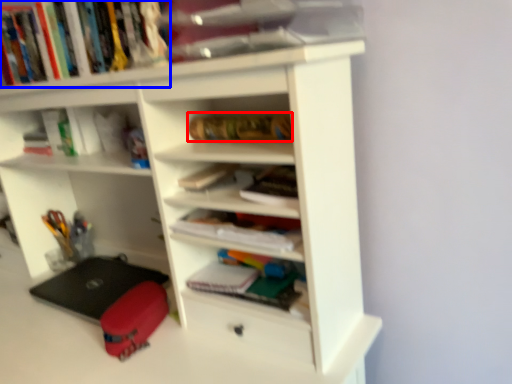
Question: Which object is closer to the camera taking this photo, book (highlighted by a red box) or book (highlighted by a blue box)?

Choices:
 (A) book
 (B) book

Answer: (B)